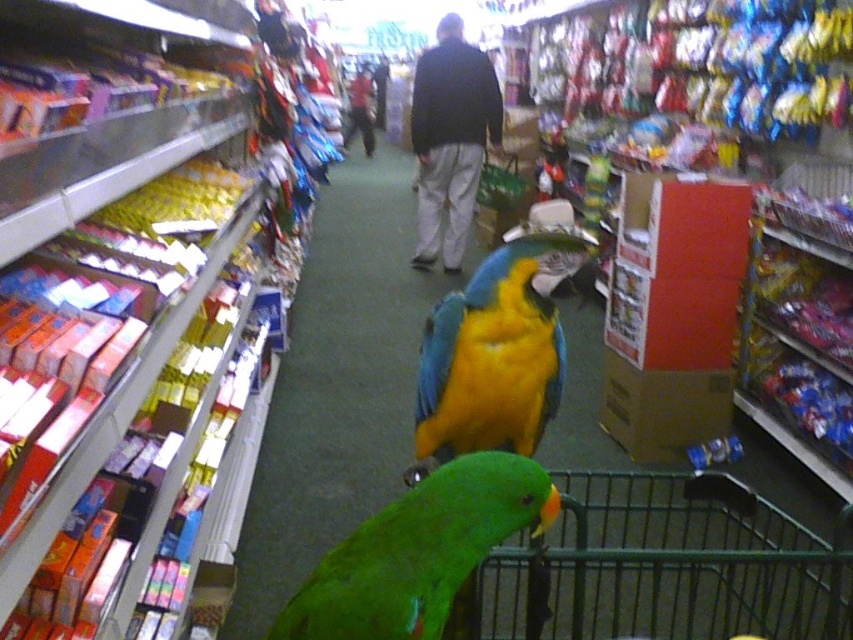
Consider the image. Between green matte parrot at lower center and blue/yellow/glossy parrot at center, which one has less height?

With less height is green matte parrot at lower center.

Which is below, green matte parrot at lower center or blue/yellow/glossy parrot at center?

green matte parrot at lower center is below.

Between point (447, 573) and point (434, 378), which one is positioned behind?

Point (434, 378)

The width and height of the screenshot is (853, 640). I want to click on green matte parrot at lower center, so 419,552.